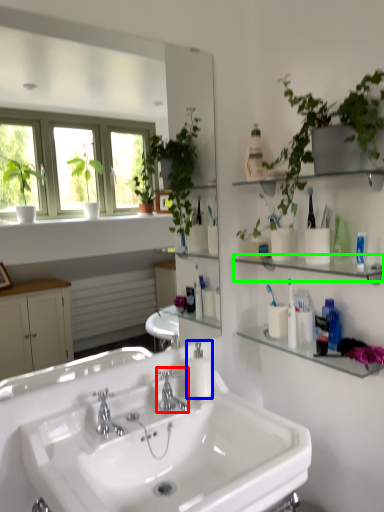
Question: Which object is the farthest from tap (highlighted by a red box)? Choose among these: soap dispenser (highlighted by a blue box) or shelf (highlighted by a green box).

Choices:
 (A) soap dispenser
 (B) shelf

Answer: (B)